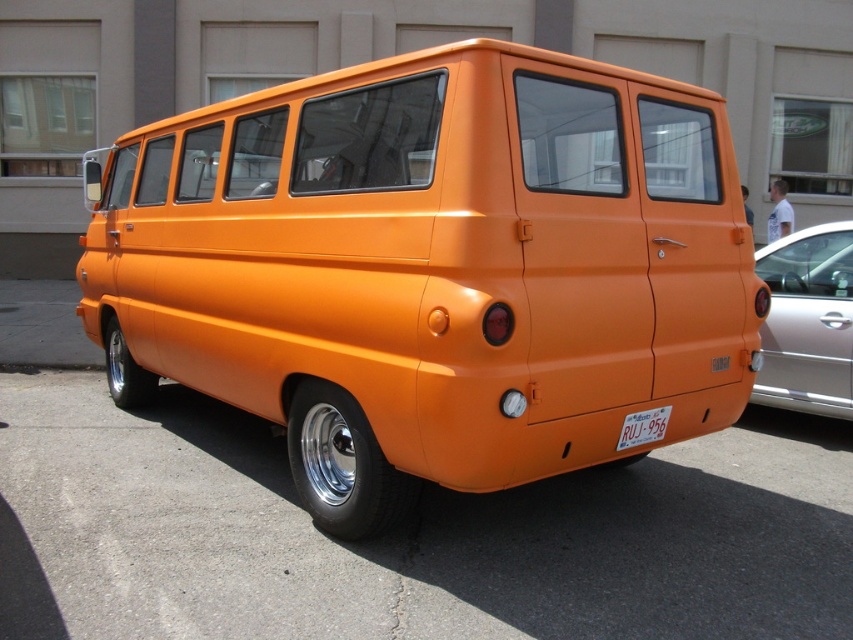
Question: Can you confirm if matte orange van at center is positioned to the right of white plastic license plate at lower center?

Choices:
 (A) no
 (B) yes

Answer: (A)

Question: Does matte orange van at center have a lesser width compared to white plastic license plate at lower center?

Choices:
 (A) yes
 (B) no

Answer: (B)

Question: Which is nearer to the orange matte van at center?

Choices:
 (A) matte orange van at center
 (B) metallic silver car at right
 (C) white plastic license plate at lower center

Answer: (C)

Question: Can you confirm if matte orange van at center is wider than orange matte van at center?

Choices:
 (A) yes
 (B) no

Answer: (A)

Question: Which of these objects is positioned farthest from the white plastic license plate at lower center?

Choices:
 (A) metallic silver car at right
 (B) orange matte van at center

Answer: (A)

Question: Which point is farther to the camera?

Choices:
 (A) (389, 129)
 (B) (801, 253)

Answer: (B)